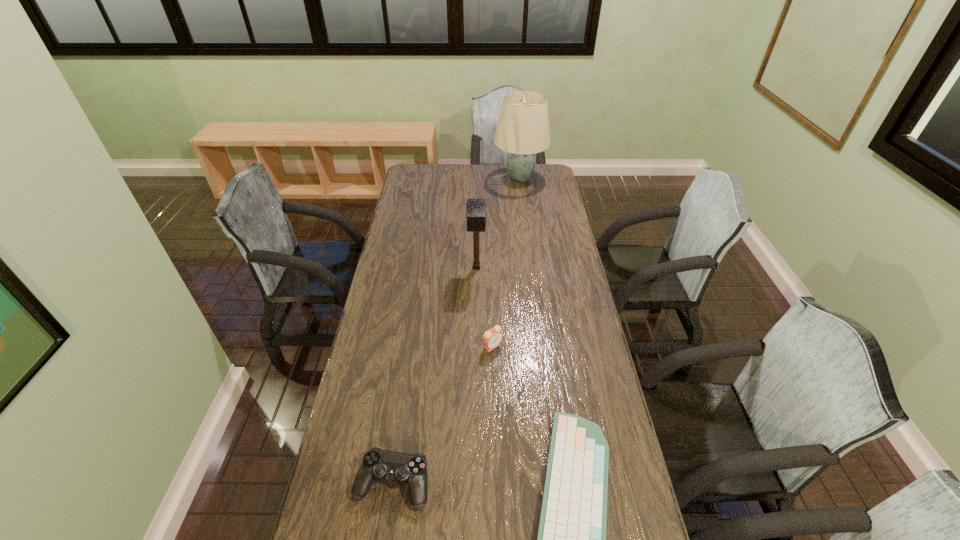
Where is `the tallest object`? the tallest object is located at coordinates (523, 130).

Find the location of `the farthest object`. the farthest object is located at coordinates (523, 130).

What are the coordinates of `the fourth nearest object` in the screenshot? It's located at (476, 208).

In order to click on the fourth shortest object in this screenshot , I will do `click(476, 208)`.

The image size is (960, 540). Find the location of `alarm clock`. alarm clock is located at coordinates (492, 337).

I want to click on the leftmost object, so click(x=379, y=465).

You are a GUI agent. You are given a task and a screenshot of the screen. Output one action in this format:
    pyautogui.click(x=<x>, y=<y>)
    Task: Click on the vacant region located 0.210m on the front of the tallest object
    This screenshot has height=540, width=960.
    Given the screenshot: What is the action you would take?
    tap(525, 217)

Where is `free region located 0.280m on the back of the mallet`? Image resolution: width=960 pixels, height=540 pixels. free region located 0.280m on the back of the mallet is located at coordinates (477, 219).

Locate an element on the screen. free space located on the face of the alarm clock is located at coordinates (492, 368).

I want to click on vacant space situated on the right of the control, so click(565, 484).